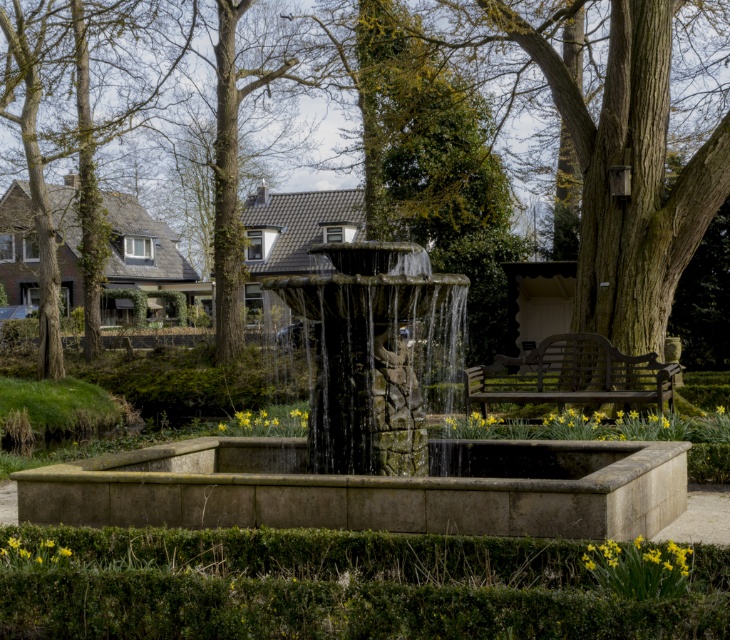
Question: Which of the following is the farthest from the observer?

Choices:
 (A) (461, 492)
 (B) (518, 29)
 (C) (345, 449)
 (D) (623, 371)

Answer: (B)

Question: Can you confirm if stone textured fountain at center is positioned above wooden bench at center?

Choices:
 (A) no
 (B) yes

Answer: (B)

Question: Which object is the farthest from the stone fountain at center?

Choices:
 (A) green leafy tree at center
 (B) wooden bench at center
 (C) stone textured fountain at center

Answer: (A)

Question: Can you confirm if green leafy tree at center is thinner than stone textured fountain at center?

Choices:
 (A) yes
 (B) no

Answer: (B)

Question: Which of these objects is positioned closest to the stone textured fountain at center?

Choices:
 (A) wooden bench at center
 (B) green leafy tree at center

Answer: (A)

Question: Can you confirm if green leafy tree at center is positioned to the left of wooden bench at center?

Choices:
 (A) no
 (B) yes

Answer: (B)